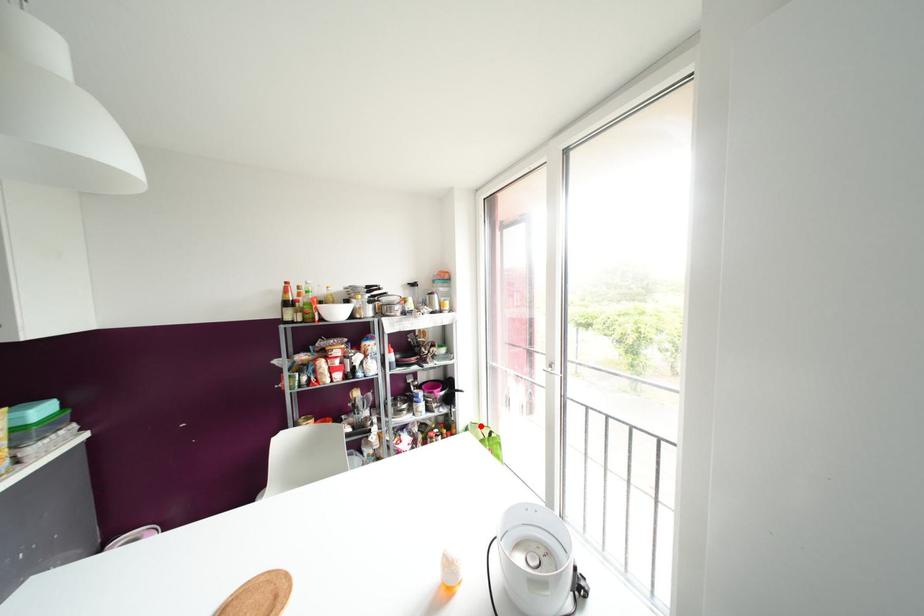
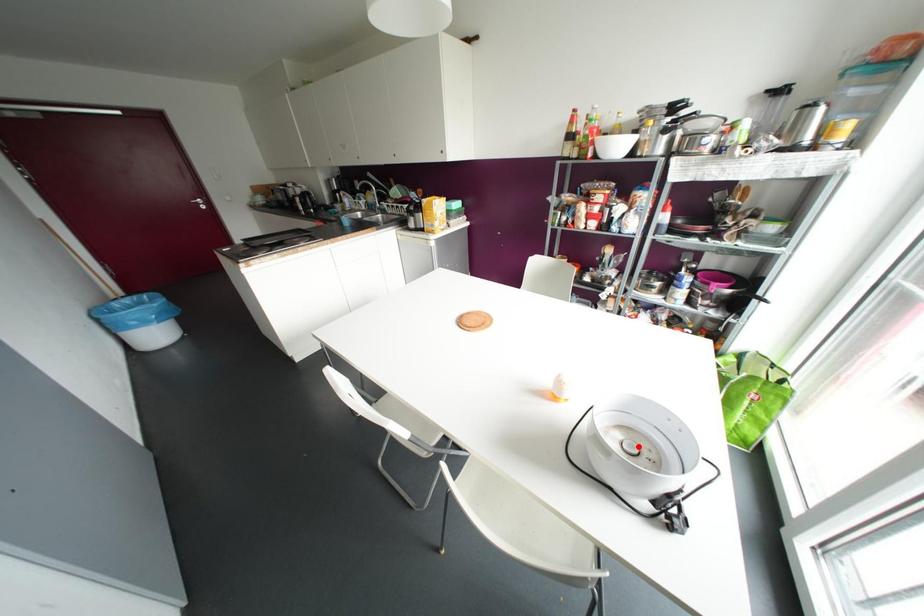
I am providing you with two images of the same scene from different viewpoints. A red point is marked on the first image and another point is marked on the second image. Does the point marked in image1 correspond to the same location as the one in image2?

No